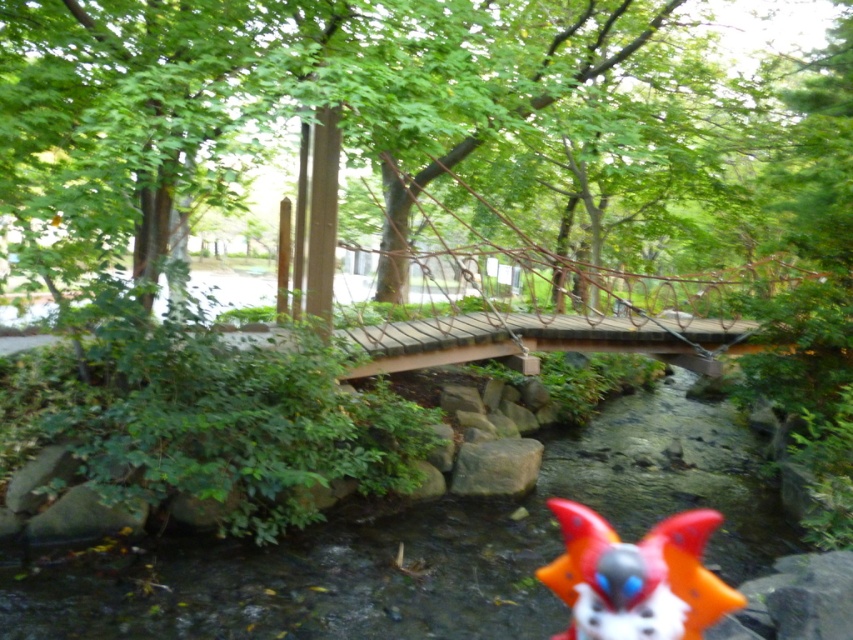
Question: Can you confirm if smooth stone creek at center is positioned below gray rough rock at center?

Choices:
 (A) yes
 (B) no

Answer: (A)

Question: Can you confirm if orange matte toy at lower right is positioned below gray rough rock at center?

Choices:
 (A) yes
 (B) no

Answer: (A)

Question: Which point appears farthest from the camera in this image?

Choices:
 (A) (463, 483)
 (B) (648, 561)

Answer: (A)

Question: Among these objects, which one is nearest to the camera?

Choices:
 (A) orange matte toy at lower right
 (B) smooth stone creek at center
 (C) gray rough rock at center

Answer: (B)

Question: Is orange matte toy at lower right positioned behind gray rough rock at center?

Choices:
 (A) yes
 (B) no

Answer: (B)

Question: Which object appears farthest from the camera in this image?

Choices:
 (A) orange matte toy at lower right
 (B) smooth stone creek at center
 (C) gray rough rock at center

Answer: (C)